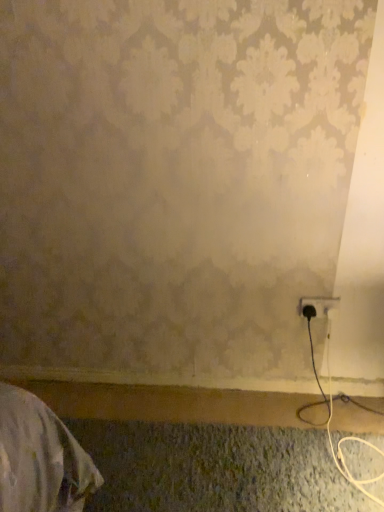
I want to click on black plastic power plug at lower right, so click(318, 307).

Image resolution: width=384 pixels, height=512 pixels. What do you see at coordinates (318, 307) in the screenshot?
I see `black plastic power plug at lower right` at bounding box center [318, 307].

You are a GUI agent. You are given a task and a screenshot of the screen. Output one action in this format:
    pyautogui.click(x=<x>, y=<y>)
    Task: Click on the black plastic power plug at lower right
    
    Given the screenshot: What is the action you would take?
    pyautogui.click(x=318, y=307)